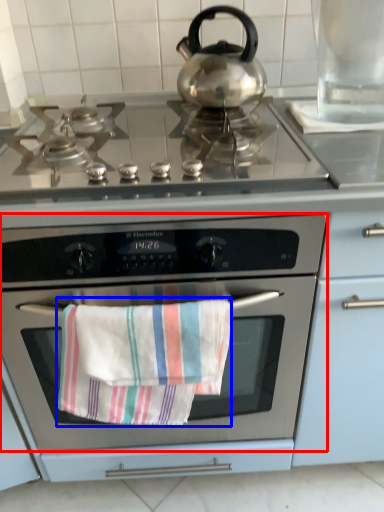
Question: Which object appears closest to the camera in this image, oven (highlighted by a red box) or beach towel (highlighted by a blue box)?

Choices:
 (A) oven
 (B) beach towel

Answer: (A)